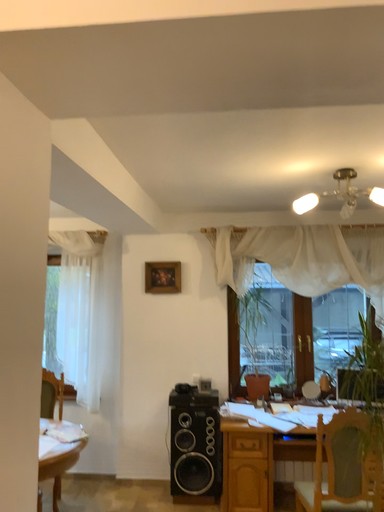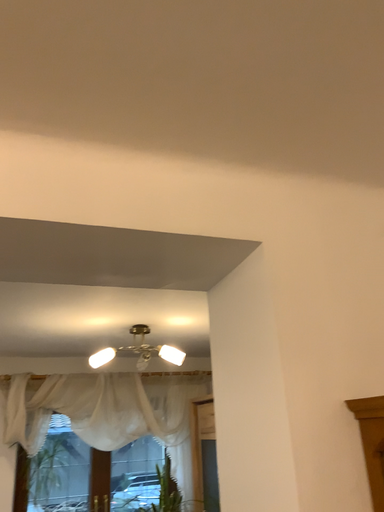
Question: Which way did the camera rotate in the video?

Choices:
 (A) rotated left
 (B) rotated right

Answer: (B)